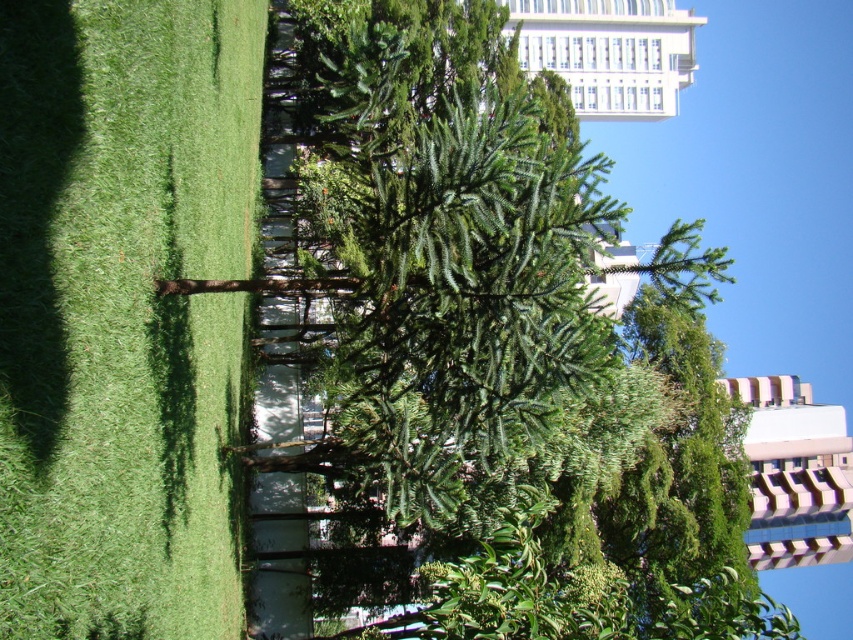
Question: Where is green needle-like at center located in relation to white glass building at upper center in the image?

Choices:
 (A) right
 (B) left

Answer: (B)

Question: Which point is farther to the camera?

Choices:
 (A) (30, 493)
 (B) (764, 384)

Answer: (B)

Question: Is white striped building at upper center smaller than white glass building at upper center?

Choices:
 (A) no
 (B) yes

Answer: (B)

Question: Among these objects, which one is nearest to the camera?

Choices:
 (A) white striped building at upper center
 (B) white glass building at upper center

Answer: (A)

Question: Which of the following is the farthest from the observer?

Choices:
 (A) white striped building at upper center
 (B) green grass at left

Answer: (A)

Question: Is green needle-like at center above white striped building at upper center?

Choices:
 (A) yes
 (B) no

Answer: (A)